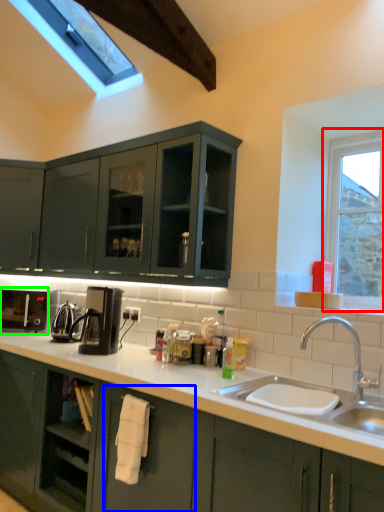
Question: Which object is positioned closest to window (highlighted by a red box)? Select from drawer (highlighted by a blue box) and coffee machine (highlighted by a green box).

Choices:
 (A) drawer
 (B) coffee machine

Answer: (A)